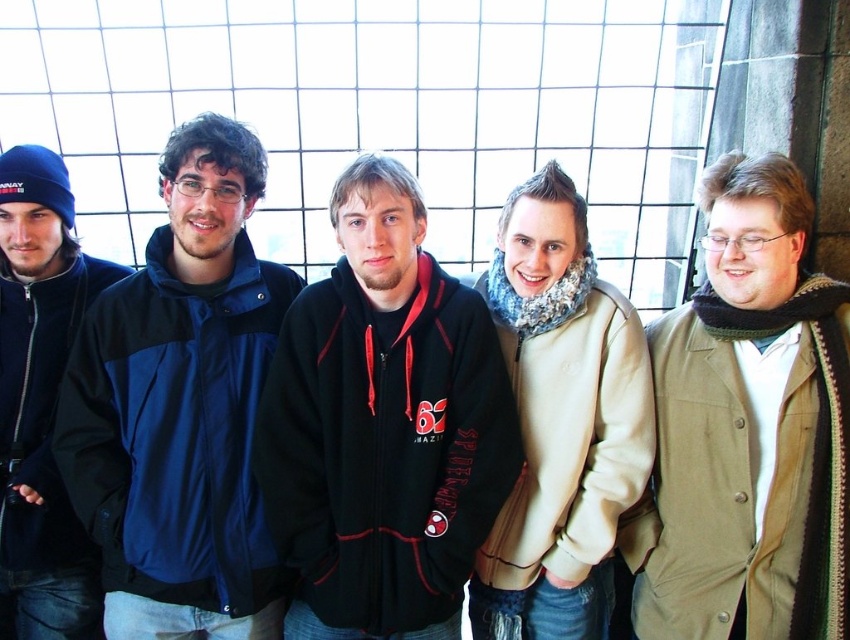
Between point (167, 548) and point (57, 273), which one is positioned behind?

Point (57, 273)

Consider the image. Is blue fabric jacket at center to the left of dark blue fleece jacket at left from the viewer's perspective?

In fact, blue fabric jacket at center is to the right of dark blue fleece jacket at left.

Measure the distance between blue fabric jacket at center and camera.

blue fabric jacket at center is 4.33 meters from camera.

This screenshot has width=850, height=640. I want to click on blue fabric jacket at center, so click(180, 406).

Is black fleece sweatshirt at center thinner than dark blue fleece jacket at left?

No, black fleece sweatshirt at center is not thinner than dark blue fleece jacket at left.

Does point (485, 529) come closer to viewer compared to point (105, 260)?

Yes, it is in front of point (105, 260).

Is point (304, 497) closer to camera compared to point (18, 388)?

Yes, point (304, 497) is in front of point (18, 388).

Locate an element on the screen. black fleece sweatshirt at center is located at coordinates (384, 449).

Who is positioned more to the right, black fleece sweatshirt at center or khaki cotton sweatshirt at right?

From the viewer's perspective, khaki cotton sweatshirt at right appears more on the right side.

Between black fleece sweatshirt at center and khaki cotton sweatshirt at right, which one is positioned lower?

khaki cotton sweatshirt at right

Between point (329, 452) and point (751, 570), which one is positioned behind?

The point (329, 452) is more distant.

Find the location of a particular element. Image resolution: width=850 pixels, height=640 pixels. black fleece sweatshirt at center is located at coordinates (384, 449).